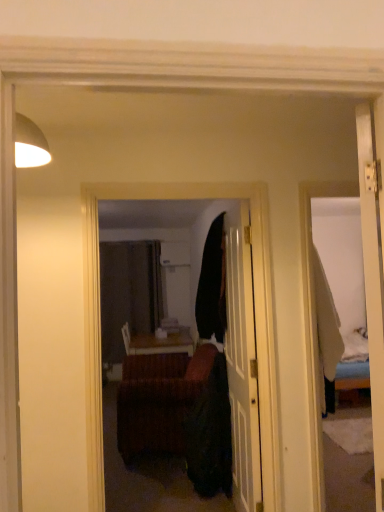
Question: Considering the relative sizes of matte black door at center and brown woven studio couch at center in the image provided, is matte black door at center bigger than brown woven studio couch at center?

Choices:
 (A) yes
 (B) no

Answer: (B)

Question: Does matte black door at center have a smaller size compared to brown woven studio couch at center?

Choices:
 (A) no
 (B) yes

Answer: (B)

Question: Is brown woven studio couch at center located within matte black door at center?

Choices:
 (A) no
 (B) yes

Answer: (A)

Question: Would you consider matte black door at center to be distant from brown woven studio couch at center?

Choices:
 (A) no
 (B) yes

Answer: (A)

Question: Is matte black door at center in front of brown woven studio couch at center?

Choices:
 (A) no
 (B) yes

Answer: (B)

Question: Can you confirm if matte black door at center is thinner than brown woven studio couch at center?

Choices:
 (A) yes
 (B) no

Answer: (A)

Question: Is matte black door at center next to matte black mirror at center?

Choices:
 (A) no
 (B) yes

Answer: (A)

Question: Is matte black door at center shorter than matte black mirror at center?

Choices:
 (A) yes
 (B) no

Answer: (B)

Question: Is matte black door at center positioned behind matte black mirror at center?

Choices:
 (A) yes
 (B) no

Answer: (A)

Question: Does matte black door at center turn towards matte black mirror at center?

Choices:
 (A) yes
 (B) no

Answer: (B)

Question: From the image's perspective, is matte black door at center below matte black mirror at center?

Choices:
 (A) yes
 (B) no

Answer: (A)

Question: From a real-world perspective, is matte black door at center physically below matte black mirror at center?

Choices:
 (A) no
 (B) yes

Answer: (B)

Question: Can you confirm if brown woven studio couch at center is taller than matte black mirror at center?

Choices:
 (A) no
 (B) yes

Answer: (A)